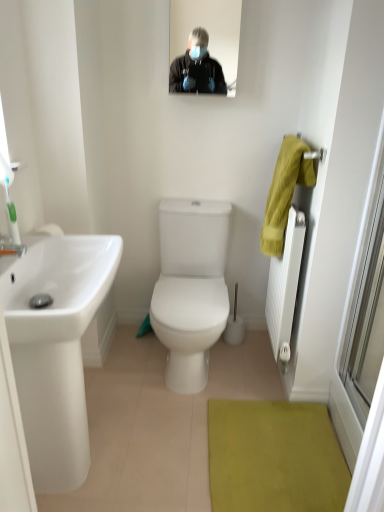
Locate an element on the screen. Image resolution: width=384 pixels, height=512 pixels. blank space situated above green textured bath mat at lower center (from a real-world perspective) is located at coordinates (284, 459).